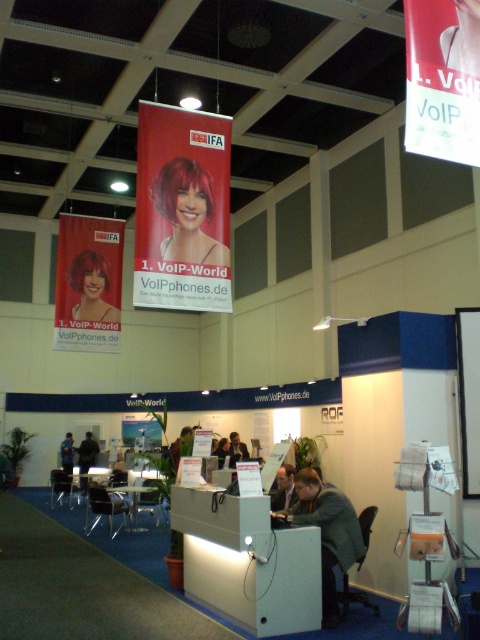
Which is behind, point (471, 406) or point (470, 38)?

The point (471, 406) is behind.

Is the position of white paper at upper center more distant than that of smooth red hair at upper center?

Yes, white paper at upper center is behind smooth red hair at upper center.

Locate an element on the screen. This screenshot has height=640, width=480. white paper at upper center is located at coordinates (468, 396).

Is matte red banner at upper left above smooth red hair at upper center?

Actually, matte red banner at upper left is below smooth red hair at upper center.

Can you confirm if matte red banner at upper left is positioned to the right of smooth red hair at upper center?

Incorrect, matte red banner at upper left is not on the right side of smooth red hair at upper center.

Does point (71, 284) come behind point (457, 65)?

Yes.

Identify the location of matte red banner at upper left. The width and height of the screenshot is (480, 640). (87, 284).

In the scene shown: Is matte red hair at upper left closer to camera compared to smooth red hair at upper center?

No, matte red hair at upper left is further to the viewer.

Between point (103, 310) and point (456, 3), which one is positioned in front?

Point (456, 3) is in front.

This screenshot has height=640, width=480. In order to click on matte red hair at upper left in this screenshot , I will do `click(91, 288)`.